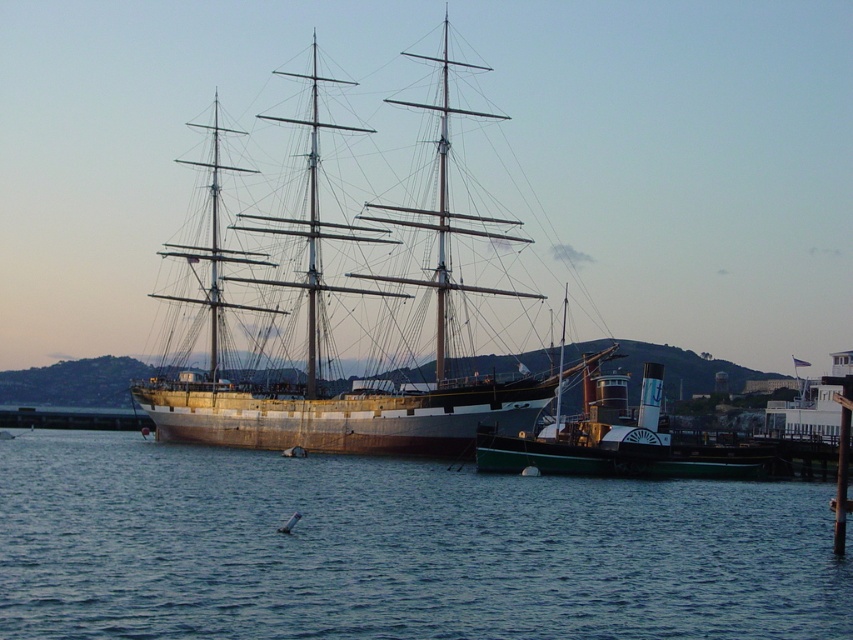
Does blue water at center come behind wooden ship at center?

No, blue water at center is in front of wooden ship at center.

I want to click on blue water at center, so click(397, 548).

Is blue water at center positioned at the back of green matte steamboat at center?

No, it is in front of green matte steamboat at center.

Is the position of blue water at center less distant than that of green matte steamboat at center?

Yes, blue water at center is closer to the viewer.

You are a GUI agent. You are given a task and a screenshot of the screen. Output one action in this format:
    pyautogui.click(x=<x>, y=<y>)
    Task: Click on the blue water at center
    This screenshot has width=853, height=640.
    Given the screenshot: What is the action you would take?
    pyautogui.click(x=397, y=548)

Image resolution: width=853 pixels, height=640 pixels. What do you see at coordinates (317, 355) in the screenshot?
I see `wooden ship at center` at bounding box center [317, 355].

Based on the photo, measure the distance between point (173,390) and camera.

Point (173,390) is 148.41 meters from camera.

Which is in front, point (397, 433) or point (544, 428)?

Point (544, 428)

This screenshot has width=853, height=640. I want to click on wooden ship at center, so click(317, 355).